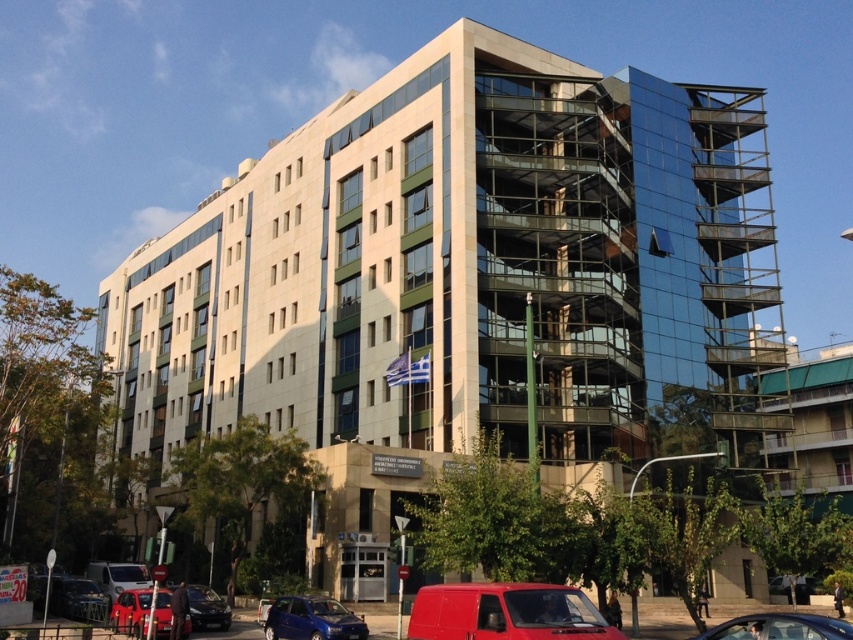
Does metallic silver car at lower center appear under shiny black sedan at lower left?

Actually, metallic silver car at lower center is above shiny black sedan at lower left.

Can you confirm if metallic silver car at lower center is positioned to the left of shiny black sedan at lower left?

No, metallic silver car at lower center is not to the left of shiny black sedan at lower left.

Find the location of a particular element. This screenshot has height=640, width=853. metallic silver car at lower center is located at coordinates (779, 627).

Between metallic blue suv at lower center and metallic silver van at lower left, which one has more height?

metallic blue suv at lower center

Between metallic blue suv at lower center and metallic silver van at lower left, which one is positioned higher?

metallic blue suv at lower center

Who is more forward, (267, 624) or (97, 616)?

Point (267, 624) is in front.

The width and height of the screenshot is (853, 640). What are the coordinates of `metallic blue suv at lower center` in the screenshot? It's located at (311, 620).

Is metallic red car at lower center smaller than metallic silver van at lower left?

No.

Is metallic red car at lower center positioned at the back of metallic silver van at lower left?

No.

Does point (161, 625) come in front of point (88, 582)?

That is True.

Where is `metallic red car at lower center`? The height and width of the screenshot is (640, 853). metallic red car at lower center is located at coordinates (131, 612).